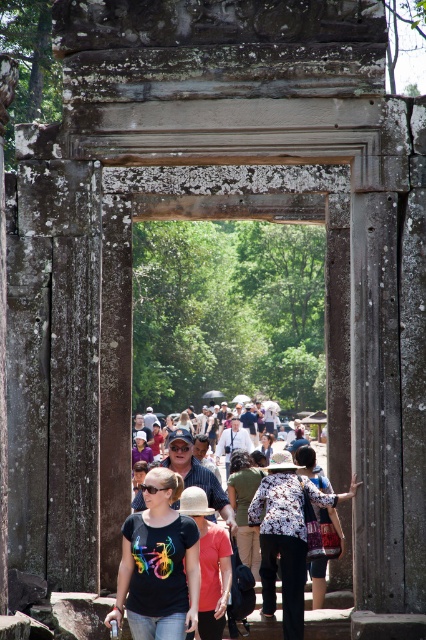
You are a photographer standing in front of the weathered stone archway. You notice the beige woven hat at center and the patterned fabric bag at center. Which object is shorter in height?

The beige woven hat at center is shorter than the patterned fabric bag at center.